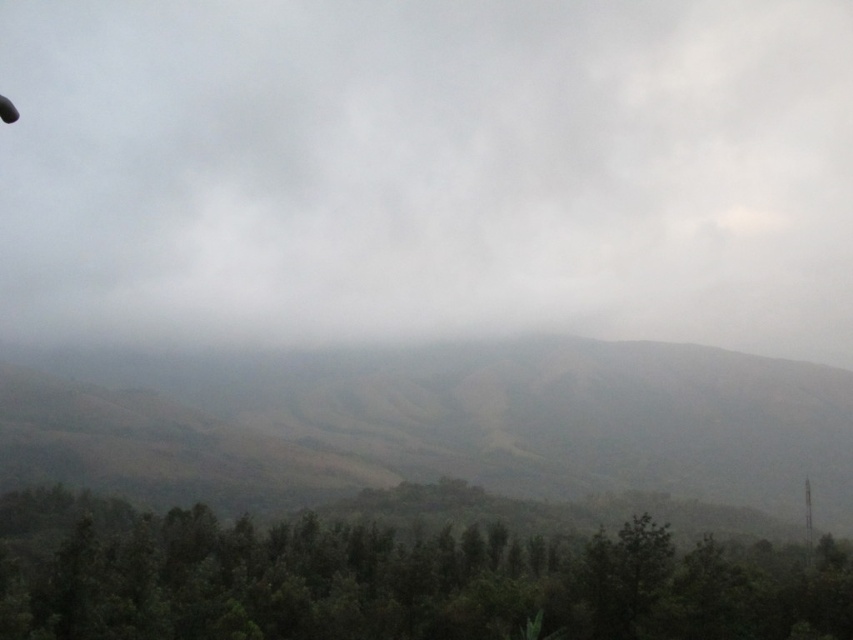
You are an explorer trying to locate the brown matte mountain at center in a misty hilly landscape. Based on the coordinates given, where would you find it in the image?

The brown matte mountain at center is located at the coordinates point (444, 428) in the image.

You are an explorer trying to navigate through the misty hills. You see the brown matte mountain at center and the green matte trees at lower center. Which object is located to the right of the other?

The brown matte mountain at center is positioned on the right side of green matte trees at lower center.